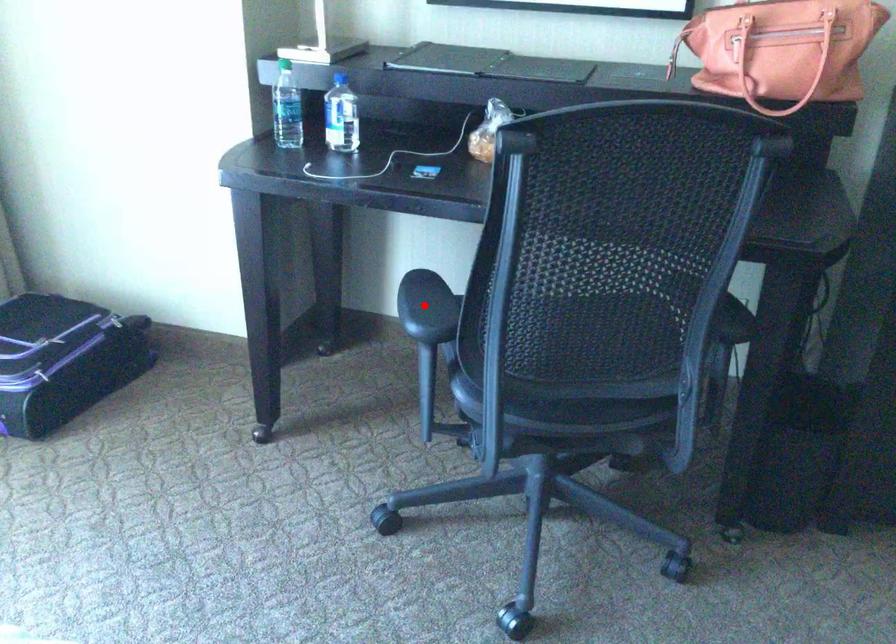
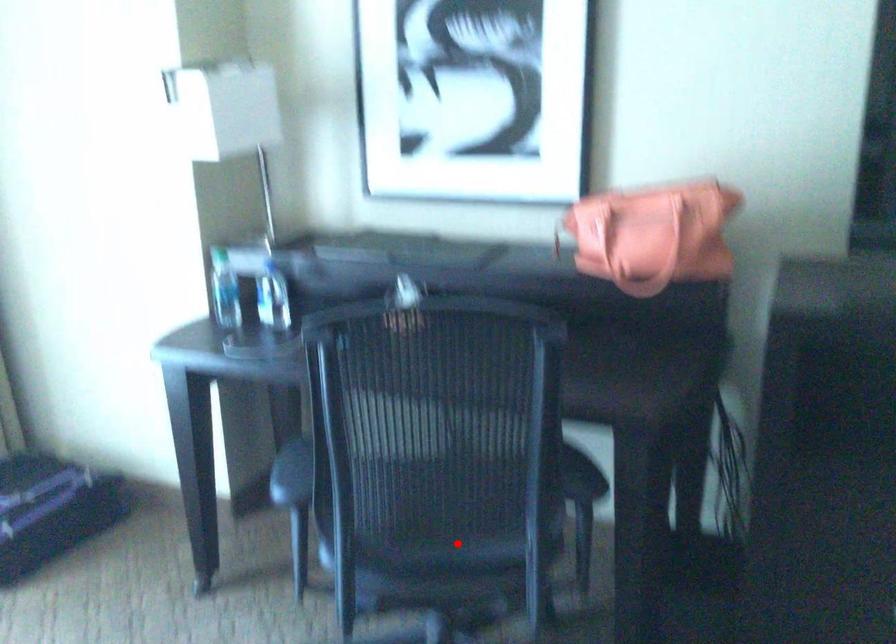
I am providing you with two images of the same scene from different viewpoints. A red point is marked on the first image and another point is marked on the second image. Do the highlighted points in image1 and image2 indicate the same real-world spot?

No